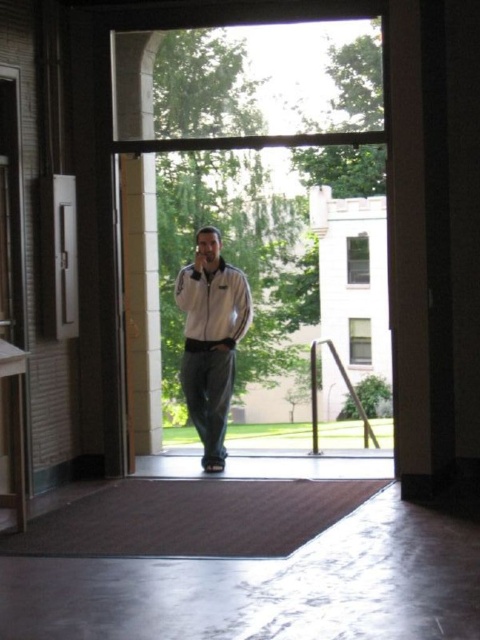
You are standing inside a building and want to exit through the transparent glass door at center. Which direction should you walk relative to the metallic silver door at left to reach it?

The transparent glass door at center is to the right of the metallic silver door at left, so you should walk to the right of the metallic silver door at left to reach it.

You are a delivery person at the entrance of a building. You need to exit through the nearest door. Which door should you choose between the transparent glass door at center and the metallic silver door at left?

The transparent glass door at center is closer to the viewer than the metallic silver door at left, so you should choose the transparent glass door at center to exit quickly.